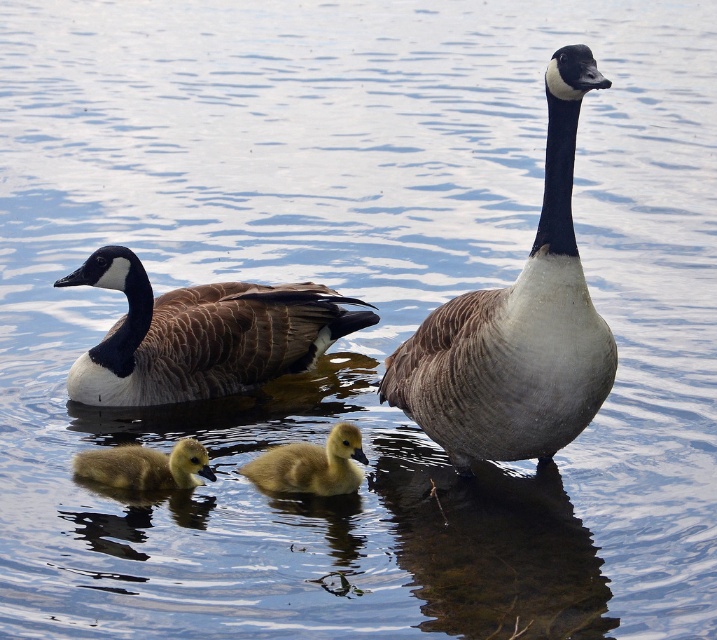
You are a photographer taking a picture of the two adult Canada geese and two goslings swimming on the water. You want to focus on the point closer to the camera. Which point should you choose between point [257,326] and point [199,480]?

Point [257,326] is further to the camera than point [199,480]. Therefore, to focus on the point closer to the camera, you should choose point [199,480].

You are a photographer trying to capture the golden downy duckling at center in your shot. Based on its position coordinates, where should you aim your camera?

The golden downy duckling at center is located at point (310,465), so you should aim your camera towards those coordinates to capture it.

You are a wildlife photographer aiming to capture a closeup of the brown feathered goose at left and the golden downy duckling at lower left. Given that your camera lens has a maximum width of 10 inches, can you fit both subjects into the frame without zooming out?

The brown feathered goose at left might be wider than golden downy duckling at lower left, but without knowing their exact widths, it is uncertain if both will fit within the 10 inch limit. Check their combined width first.